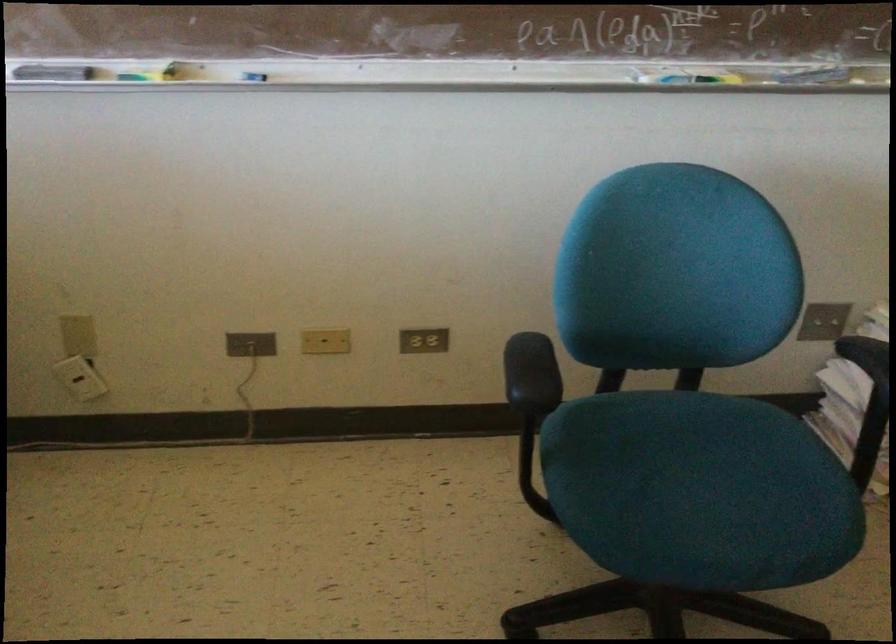
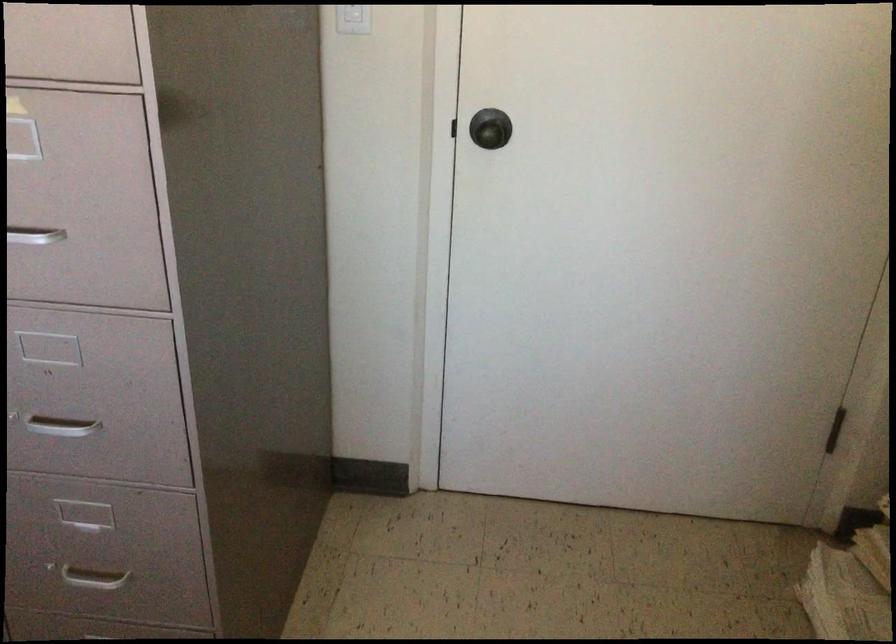
Based on the continuous images, in which direction is the camera rotating?

The camera's rotation is toward right-down.